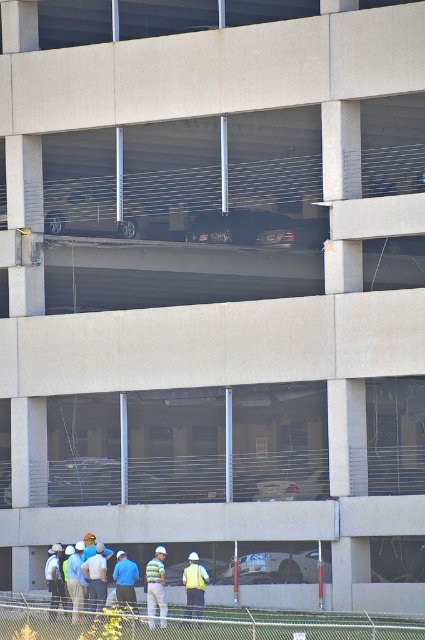
You are a safety inspector in the parking structure. You notice two reflective yellow vests. Which one takes up more space, the reflective yellow vest at center or the reflective yellow safety vest at lower center?

The reflective yellow safety vest at lower center takes up more space than the reflective yellow vest at center.

You are a safety inspector at the construction site. You notice two items in the scene, the reflective yellow vest at center and the blue fabric shirt at lower center. Which item is narrower in width?

The reflective yellow vest at center is thinner than the blue fabric shirt at lower center, so the reflective yellow vest at center is narrower in width.